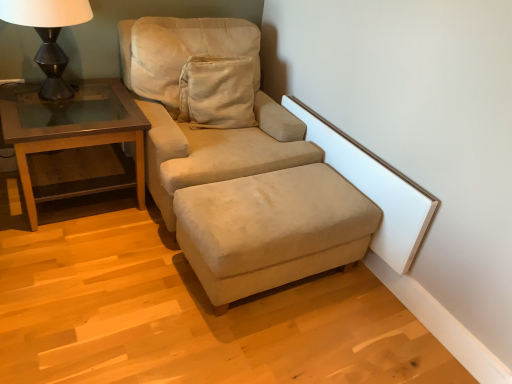
Locate an element on the screen. vacant space in between brown wood/glass table at left and suede beige studio couch at center is located at coordinates (106, 231).